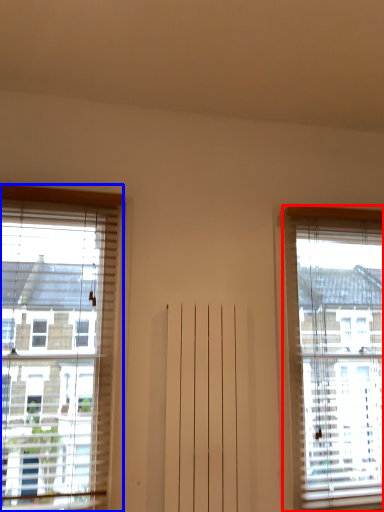
Question: Among these objects, which one is farthest to the camera, window (highlighted by a red box) or window (highlighted by a blue box)?

Choices:
 (A) window
 (B) window

Answer: (A)